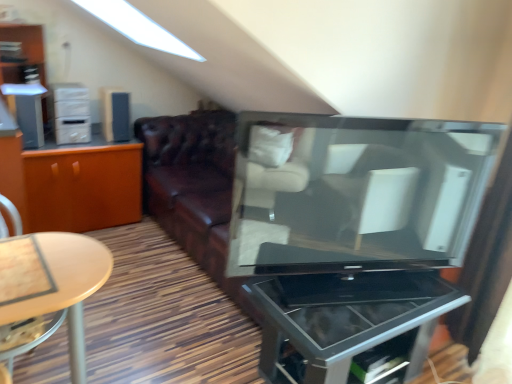
Image resolution: width=512 pixels, height=384 pixels. What are the coordinates of `free space in front of white plastic cabinet at left` in the screenshot? It's located at (56, 147).